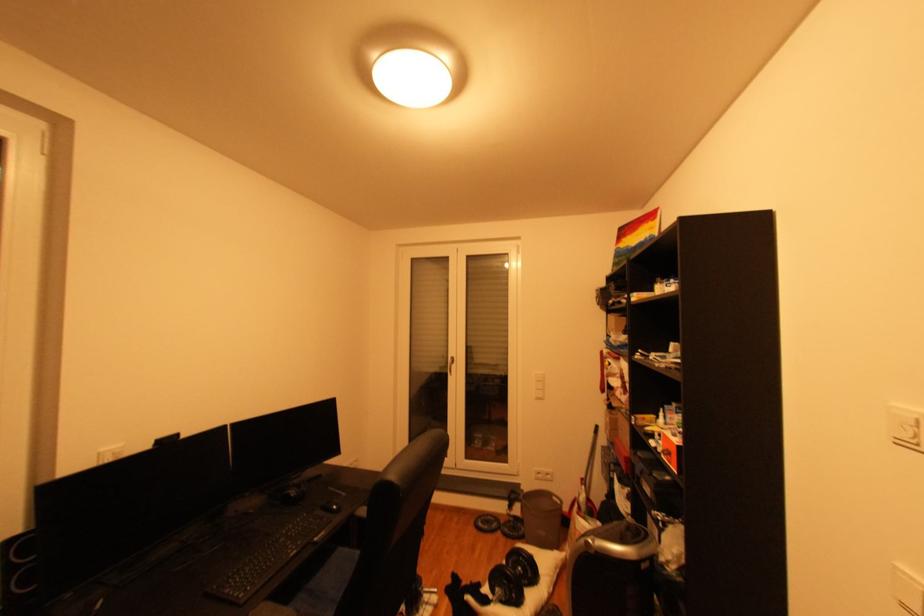
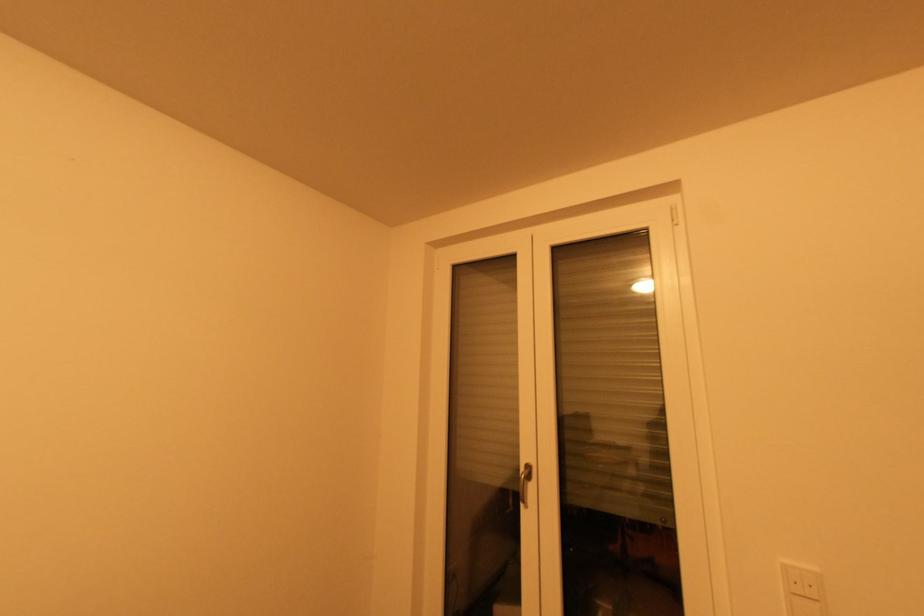
Question: The images are taken continuously from a first-person perspective. In which direction are you moving?

Choices:
 (A) Left
 (B) Right
 (C) Forward
 (D) Backward

Answer: (C)